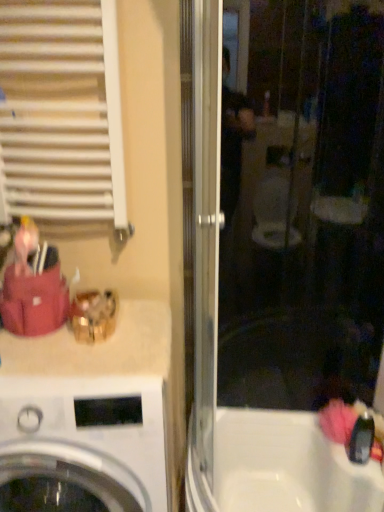
Question: Is white matte radiator at upper left smaller than white glossy washing machine at lower left?

Choices:
 (A) yes
 (B) no

Answer: (A)

Question: From the image's perspective, is white matte radiator at upper left beneath white glossy washing machine at lower left?

Choices:
 (A) no
 (B) yes

Answer: (A)

Question: Can you confirm if white matte radiator at upper left is taller than white glossy washing machine at lower left?

Choices:
 (A) no
 (B) yes

Answer: (A)

Question: Considering the relative positions of white matte radiator at upper left and white glossy washing machine at lower left in the image provided, is white matte radiator at upper left to the left of white glossy washing machine at lower left from the viewer's perspective?

Choices:
 (A) no
 (B) yes

Answer: (B)

Question: Considering the relative sizes of white matte radiator at upper left and white glossy washing machine at lower left in the image provided, is white matte radiator at upper left wider than white glossy washing machine at lower left?

Choices:
 (A) no
 (B) yes

Answer: (A)

Question: From a real-world perspective, is white matte radiator at upper left located higher than white glossy washing machine at lower left?

Choices:
 (A) no
 (B) yes

Answer: (B)

Question: From a real-world perspective, is white glossy washing machine at lower left below white matte radiator at upper left?

Choices:
 (A) yes
 (B) no

Answer: (A)

Question: Is white matte radiator at upper left completely or partially inside white glossy washing machine at lower left?

Choices:
 (A) no
 (B) yes

Answer: (A)

Question: From the image's perspective, would you say white glossy washing machine at lower left is shown under white matte radiator at upper left?

Choices:
 (A) yes
 (B) no

Answer: (A)

Question: Is white glossy washing machine at lower left bigger than white matte radiator at upper left?

Choices:
 (A) no
 (B) yes

Answer: (B)

Question: Considering the relative positions of white glossy washing machine at lower left and white matte radiator at upper left in the image provided, is white glossy washing machine at lower left to the right of white matte radiator at upper left from the viewer's perspective?

Choices:
 (A) yes
 (B) no

Answer: (A)

Question: Is white glossy washing machine at lower left oriented away from white matte radiator at upper left?

Choices:
 (A) no
 (B) yes

Answer: (A)

Question: Is transparent glass screen door at center with white matte radiator at upper left?

Choices:
 (A) yes
 (B) no

Answer: (B)